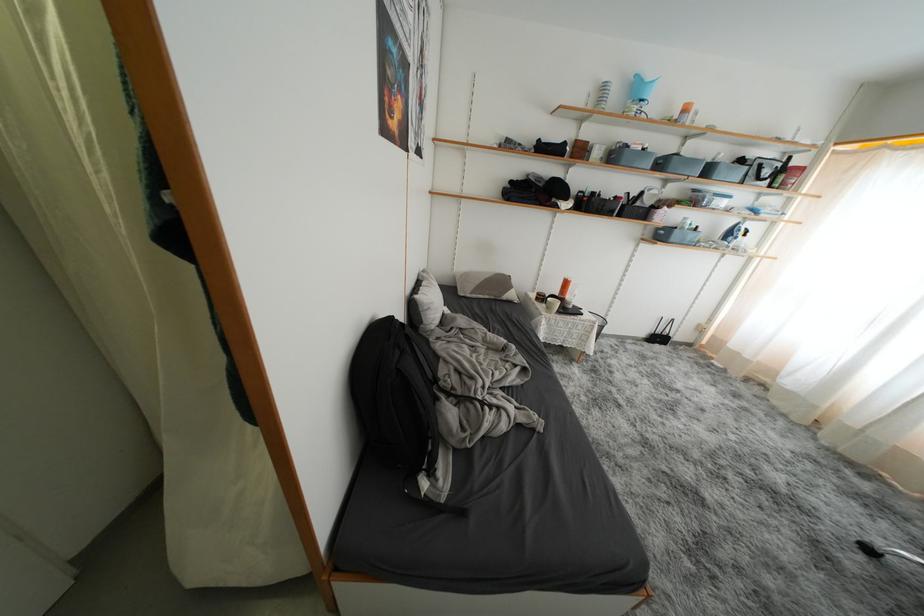
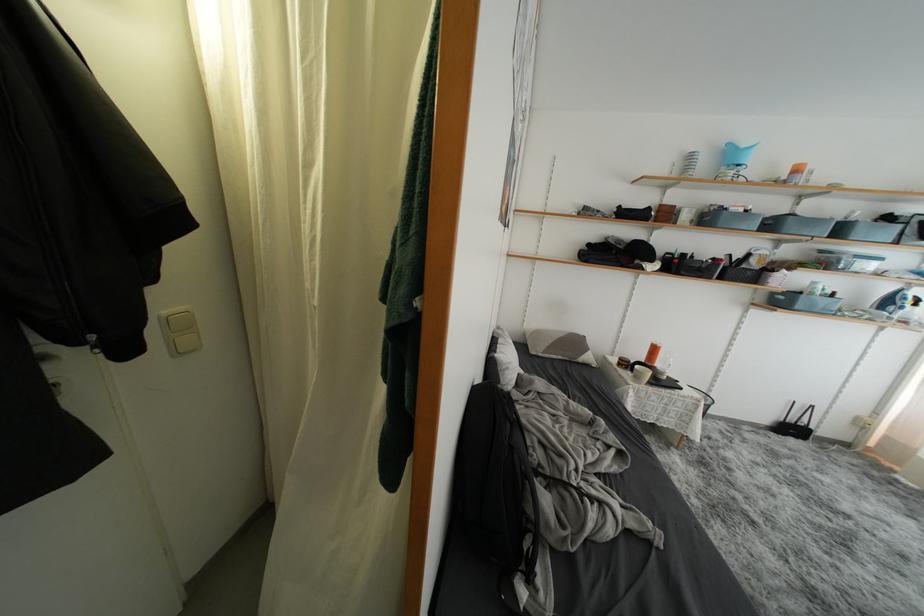
The point at (x=610, y=152) is marked in the first image. Where is the corresponding point in the second image?

(700, 215)